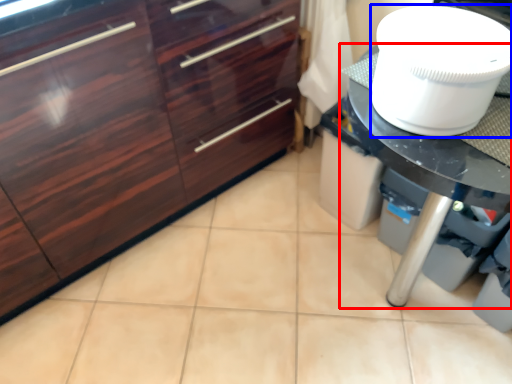
Question: Which object is further to the camera taking this photo, countertop (highlighted by a red box) or toilet bowl (highlighted by a blue box)?

Choices:
 (A) countertop
 (B) toilet bowl

Answer: (A)